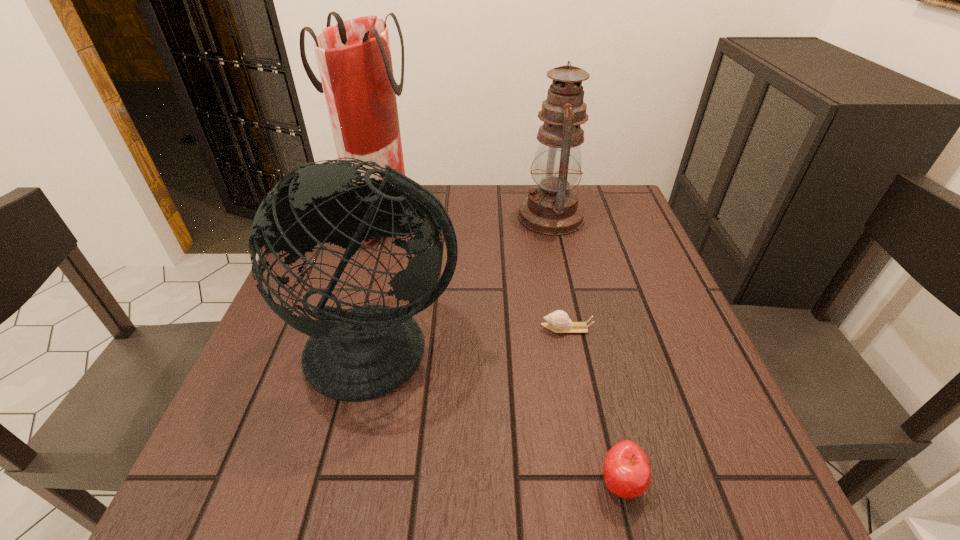
Find the location of a particular element. Image resolution: width=960 pixels, height=540 pixels. grocery bag is located at coordinates (354, 59).

Identify the location of oil lamp. This screenshot has height=540, width=960. (552, 208).

You are a GUI agent. You are given a task and a screenshot of the screen. Output one action in this format:
    pyautogui.click(x=<x>, y=<y>)
    Task: Click on the globe
    
    Given the screenshot: What is the action you would take?
    pyautogui.click(x=361, y=353)

Locate an element on the screen. the nearest object is located at coordinates (626, 470).

Locate an element on the screen. This screenshot has width=960, height=540. apple is located at coordinates (626, 470).

Where is `escargot`? The image size is (960, 540). escargot is located at coordinates (559, 322).

The image size is (960, 540). Find the location of `vacant region located on the right of the grocery bag`. vacant region located on the right of the grocery bag is located at coordinates (519, 214).

Find the location of `vacant space located 0.220m on the left of the oil lamp`. vacant space located 0.220m on the left of the oil lamp is located at coordinates (437, 217).

Find the location of a particular element. This screenshot has height=540, width=960. vacant area located on the front-facing side of the globe is located at coordinates (348, 496).

Where is `vacant point located on the left of the nearest object`? vacant point located on the left of the nearest object is located at coordinates (539, 483).